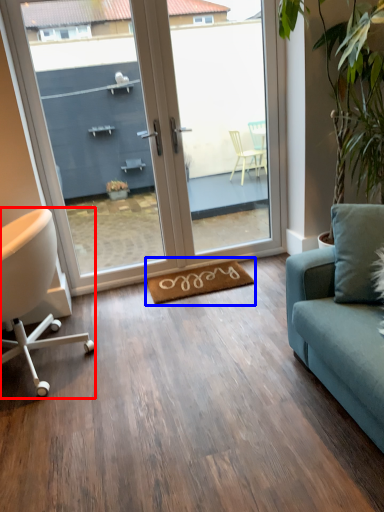
Question: Among these objects, which one is farthest to the camera, chair (highlighted by a red box) or yoga mat (highlighted by a blue box)?

Choices:
 (A) chair
 (B) yoga mat

Answer: (B)